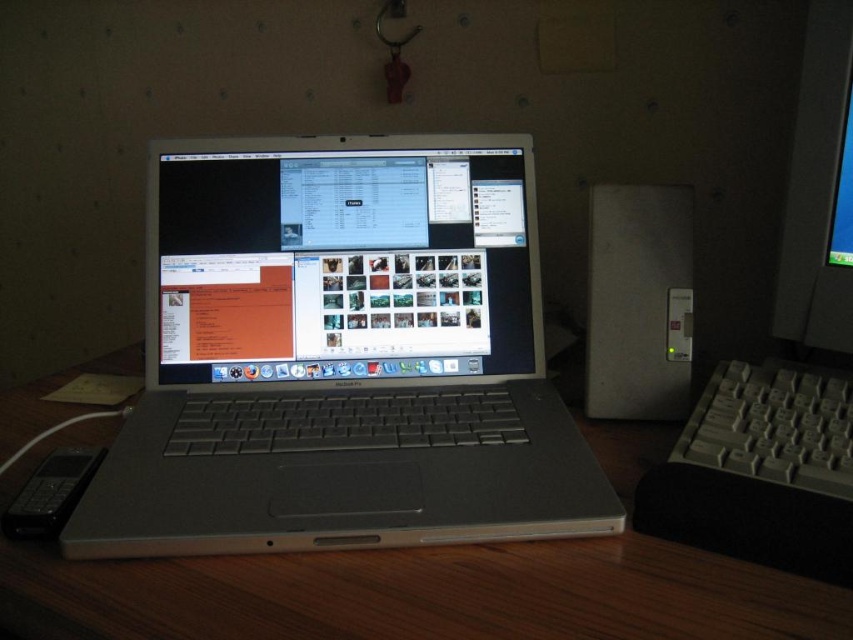
Question: Observing the image, what is the correct spatial positioning of satin silver laptop at center in reference to white plastic keyboard at right?

Choices:
 (A) right
 (B) left

Answer: (B)

Question: Which point is closer to the camera?

Choices:
 (A) satin silver laptop at center
 (B) white plastic keyboard at right
 (C) silver metallic laptop at center

Answer: (C)

Question: Does wooden desk at center have a larger size compared to satin silver desktop computer at right?

Choices:
 (A) no
 (B) yes

Answer: (B)

Question: Which point appears farthest from the camera in this image?

Choices:
 (A) (782, 483)
 (B) (318, 390)
 (C) (198, 268)
 (D) (332, 621)

Answer: (C)

Question: Estimate the real-world distances between objects in this image. Which object is closer to the satin silver laptop at center?

Choices:
 (A) silver metallic laptop at center
 (B) satin silver desktop computer at right

Answer: (A)

Question: Is satin silver desktop computer at right wider than matte black monitor at right?

Choices:
 (A) yes
 (B) no

Answer: (A)